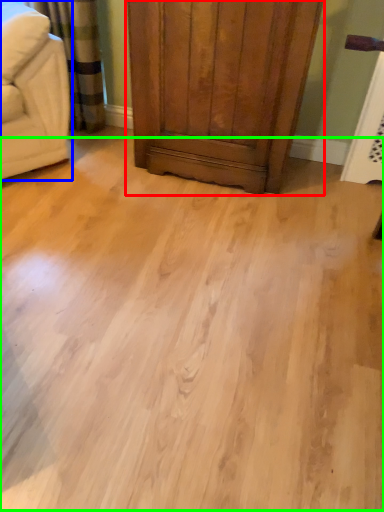
Question: Based on their relative distances, which object is nearer to dresser (highlighted by a red box)? Choose from furniture (highlighted by a blue box) and plain (highlighted by a green box).

Choices:
 (A) furniture
 (B) plain

Answer: (A)